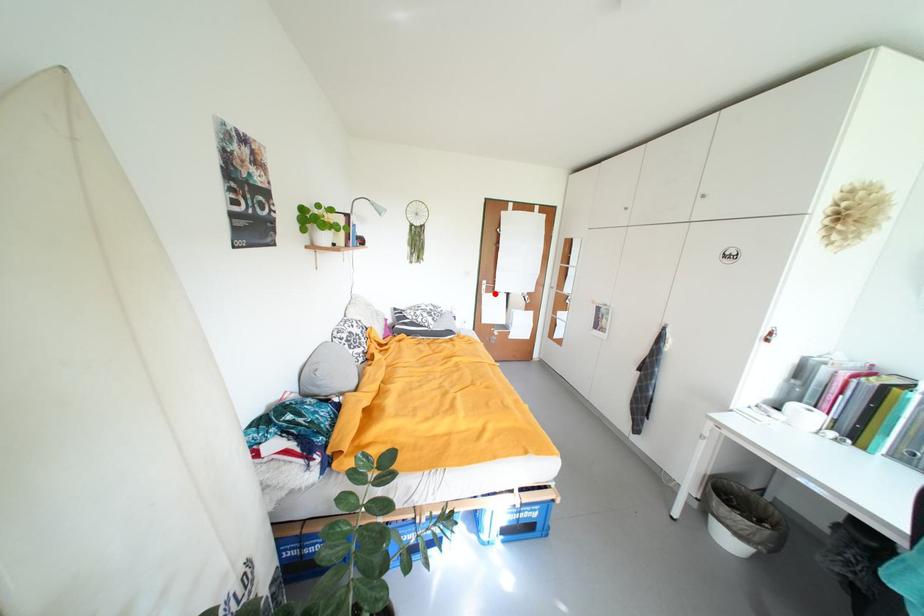
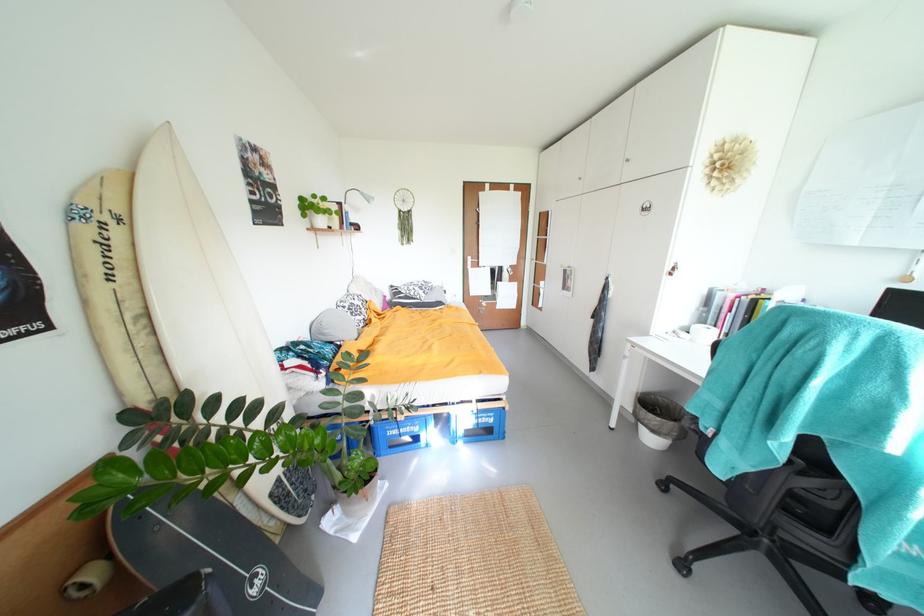
In the second image, find the point that corresponds to the highlighted location in the first image.

(480, 268)